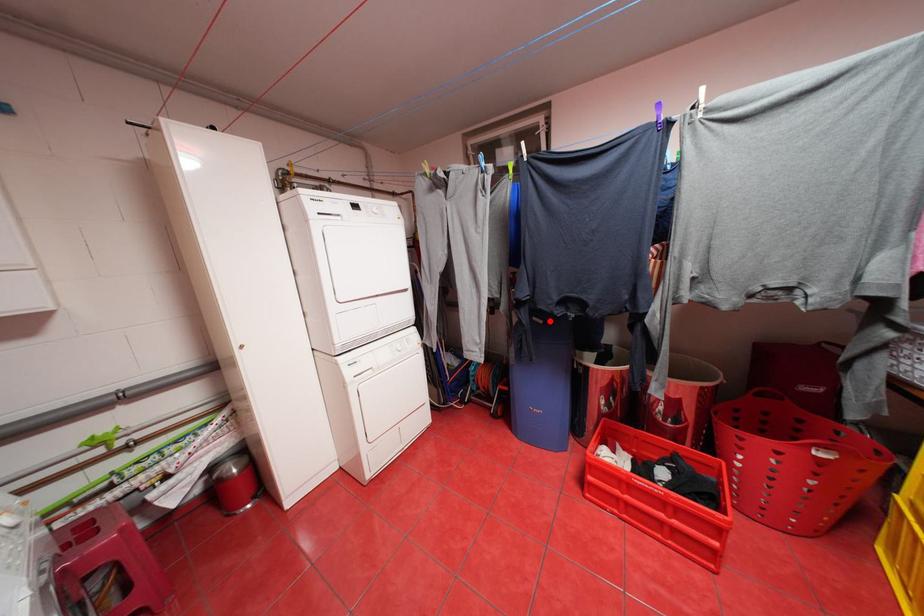
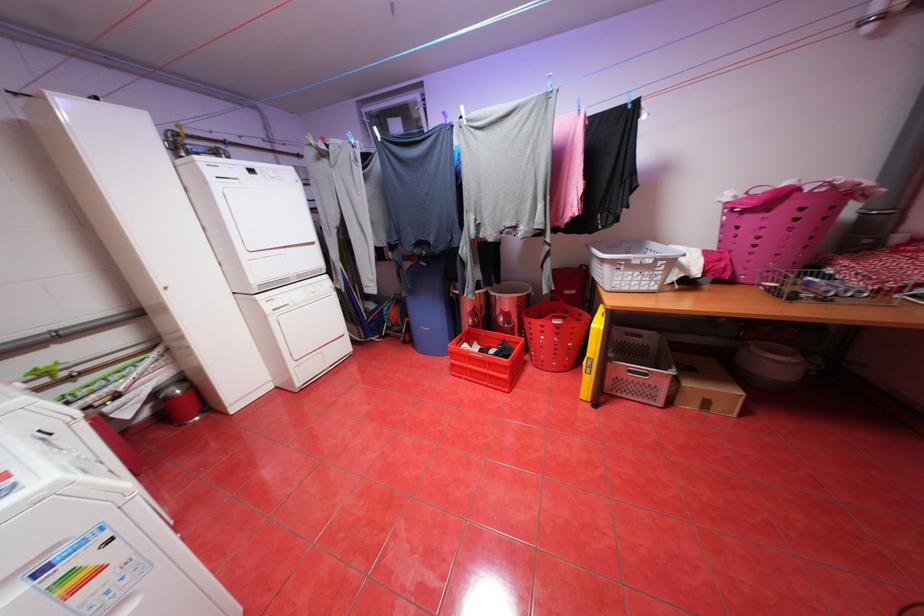
In the second image, find the point that corresponds to the highlighted location in the first image.

(433, 264)